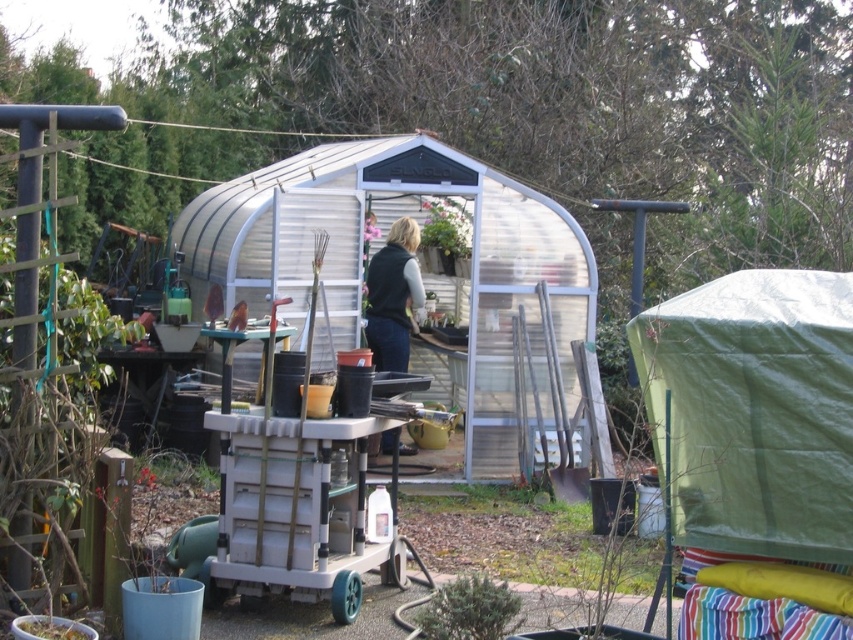
Question: Estimate the real-world distances between objects in this image. Which object is farther from the green matte pot at center?

Choices:
 (A) dark green fabric vest at center
 (B) green matte bush at lower center
 (C) white plastic cart at center

Answer: (B)

Question: Does green matte bush at lower center appear on the left side of green matte pot at center?

Choices:
 (A) no
 (B) yes

Answer: (A)

Question: Which object is closer to the camera taking this photo?

Choices:
 (A) green matte bush at lower center
 (B) white plastic cart at center

Answer: (A)

Question: Estimate the real-world distances between objects in this image. Which object is farther from the green matte pot at center?

Choices:
 (A) white plastic cart at center
 (B) dark green fabric vest at center
 (C) green matte bush at lower center

Answer: (C)

Question: Does white plastic cart at center appear on the left side of green matte bush at lower center?

Choices:
 (A) yes
 (B) no

Answer: (A)

Question: Is dark green fabric vest at center closer to camera compared to green matte bush at lower center?

Choices:
 (A) yes
 (B) no

Answer: (B)